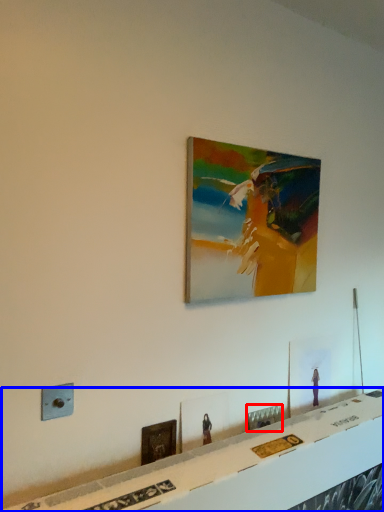
Question: Which point is closer to the camera, picture frame (highlighted by a red box) or table (highlighted by a blue box)?

Choices:
 (A) picture frame
 (B) table

Answer: (B)